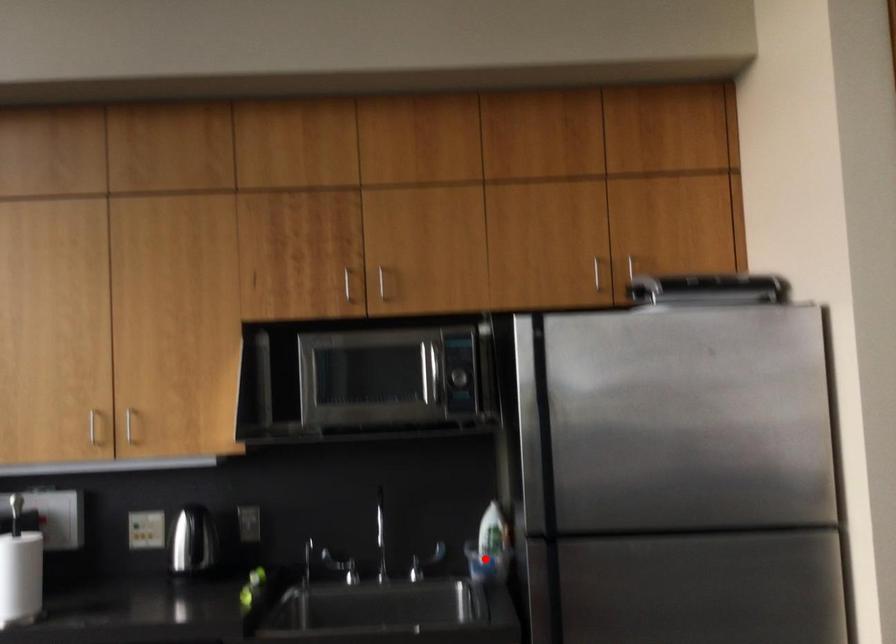
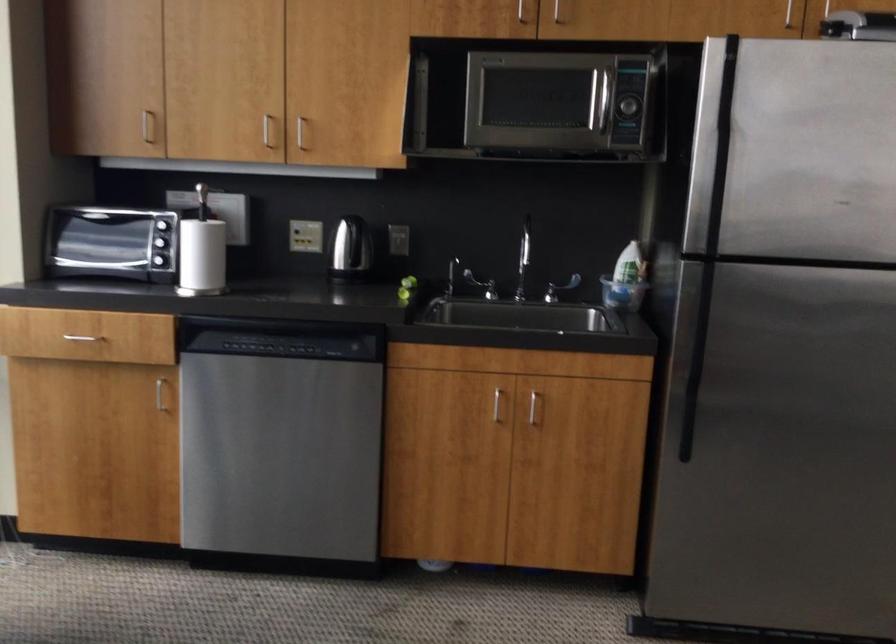
Find the pixel in the second image that matches the highlighted location in the first image.

(622, 294)